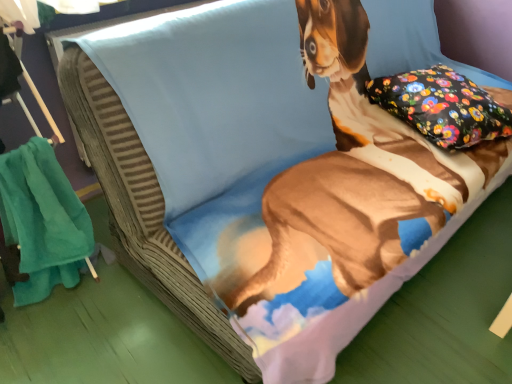
Describe the element at coordinates (42, 221) in the screenshot. The width and height of the screenshot is (512, 384). I see `teal soft towel at left` at that location.

The width and height of the screenshot is (512, 384). I want to click on teal soft towel at left, so click(x=42, y=221).

At what (x,y) coordinates should I click in order to perform the action: click on floral fabric pillow at upper right. Please return your answer as a coordinate pair (x, y). The width and height of the screenshot is (512, 384). Looking at the image, I should click on (442, 106).

What do you see at coordinates (442, 106) in the screenshot? This screenshot has height=384, width=512. I see `floral fabric pillow at upper right` at bounding box center [442, 106].

The image size is (512, 384). What are the coordinates of `teal soft towel at left` in the screenshot? It's located at point(42,221).

Considering the relative positions of floral fabric pillow at upper right and teal soft towel at left in the image provided, is floral fabric pillow at upper right to the left or to the right of teal soft towel at left?

Based on their positions, floral fabric pillow at upper right is located to the right of teal soft towel at left.

Is floral fabric pillow at upper right positioned in front of teal soft towel at left?

No, the depth of floral fabric pillow at upper right is greater than that of teal soft towel at left.

Is point (467, 138) closer or farther from the camera than point (38, 218)?

Point (467, 138) appears to be farther away from the viewer than point (38, 218).

From the image's perspective, would you say floral fabric pillow at upper right is shown under teal soft towel at left?

Actually, floral fabric pillow at upper right appears above teal soft towel at left in the image.

From a real-world perspective, is floral fabric pillow at upper right on teal soft towel at left?

Indeed, from a real-world perspective, floral fabric pillow at upper right stands above teal soft towel at left.

Which of these two, floral fabric pillow at upper right or teal soft towel at left, is wider?

Wider between the two is floral fabric pillow at upper right.

Is floral fabric pillow at upper right taller than teal soft towel at left?

No.

Is floral fabric pillow at upper right smaller than teal soft towel at left?

No.

Choose the correct answer: Is floral fabric pillow at upper right inside teal soft towel at left or outside it?

floral fabric pillow at upper right is not inside teal soft towel at left, it's outside.

Is floral fabric pillow at upper right not close to teal soft towel at left?

floral fabric pillow at upper right is far away from teal soft towel at left.

Is floral fabric pillow at upper right aimed at teal soft towel at left?

No, floral fabric pillow at upper right is not turned towards teal soft towel at left.

What's the angular difference between floral fabric pillow at upper right and teal soft towel at left's facing directions?

15.1 degrees separate the facing orientations of floral fabric pillow at upper right and teal soft towel at left.

The height and width of the screenshot is (384, 512). In order to click on blanket that is below the floral fabric pillow at upper right (from the image's perspective) in this screenshot , I will do `click(42, 221)`.

Is teal soft towel at left at the right side of floral fabric pillow at upper right?

No.

Does teal soft towel at left come in front of floral fabric pillow at upper right?

That is True.

Which is less distant, (21, 163) or (461, 81)?

Clearly, point (21, 163) is closer to the camera than point (461, 81).

From the image's perspective, which is above, teal soft towel at left or floral fabric pillow at upper right?

floral fabric pillow at upper right, from the image's perspective.

From a real-world perspective, who is located lower, teal soft towel at left or floral fabric pillow at upper right?

teal soft towel at left.

Which of these two, teal soft towel at left or floral fabric pillow at upper right, is thinner?

Thinner between the two is teal soft towel at left.

Which of these two, teal soft towel at left or floral fabric pillow at upper right, stands taller?

teal soft towel at left is taller.

Who is smaller, teal soft towel at left or floral fabric pillow at upper right?

Smaller between the two is teal soft towel at left.

Is teal soft towel at left spatially inside floral fabric pillow at upper right, or outside of it?

teal soft towel at left is spatially situated outside floral fabric pillow at upper right.

Is teal soft towel at left with floral fabric pillow at upper right?

No, teal soft towel at left is not making contact with floral fabric pillow at upper right.

Is teal soft towel at left aimed at floral fabric pillow at upper right?

No, teal soft towel at left is not turned towards floral fabric pillow at upper right.

In the scene shown: How different are the orientations of teal soft towel at left and floral fabric pillow at upper right in degrees?

The angular difference between teal soft towel at left and floral fabric pillow at upper right is 15.1 degrees.

Where is `blanket that is below the floral fabric pillow at upper right (from the image's perspective)`? blanket that is below the floral fabric pillow at upper right (from the image's perspective) is located at coordinates (42, 221).

The image size is (512, 384). In order to click on blanket in front of the floral fabric pillow at upper right in this screenshot , I will do `click(42, 221)`.

The height and width of the screenshot is (384, 512). Find the location of `pillow that appears above the teal soft towel at left (from a real-world perspective)`. pillow that appears above the teal soft towel at left (from a real-world perspective) is located at coordinates point(442,106).